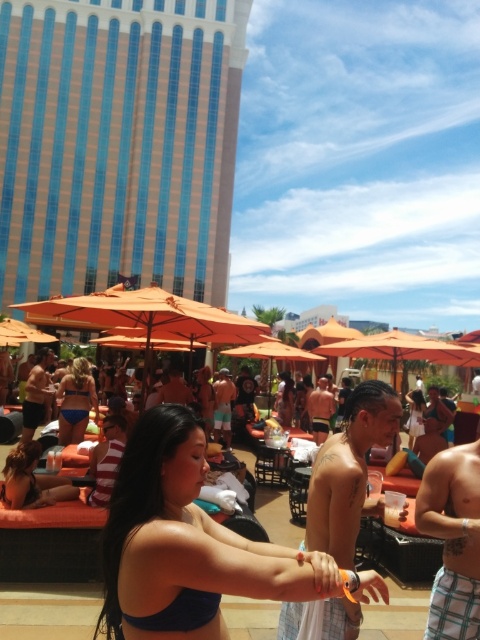
Based on the photo, you are standing at the poolside and see the shiny metallic arm at center. If you want to reach it without moving your feet, can you do so?

The shiny metallic arm at center is 2.35 meters away from you, so you cannot reach it without moving your feet since the average human arm length is about 0.7 meters.

You are a fashion designer observing the poolside scene. You need to determine which clothing item is narrower between the matte blue bikini top at center and the shiny metallic tank top at center. Which one is narrower?

The matte blue bikini top at center is narrower than the shiny metallic tank top at center according to the description.

You are a lifeguard standing at the edge of the pool. You need to quickly reach either the matte black bikini at lower left or the matte blue bikini top at center in case of an emergency. Which one is closer to you?

The matte blue bikini top at center is closer to the lifeguard because the distance between the matte black bikini at lower left and the matte blue bikini top at center is 11.27 feet, so the closer one would be the matte blue bikini top at center if the lifeguard is positioned at the edge of the pool.